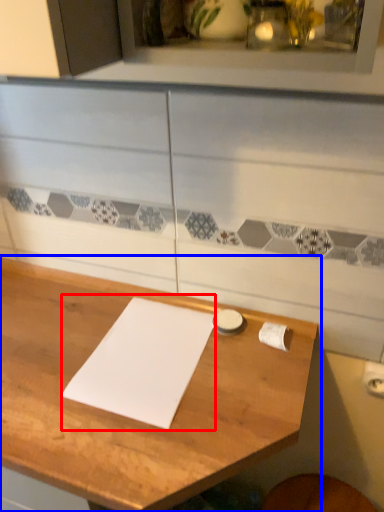
Question: Which object appears closest to the camera in this image, journal (highlighted by a red box) or table (highlighted by a blue box)?

Choices:
 (A) journal
 (B) table

Answer: (B)